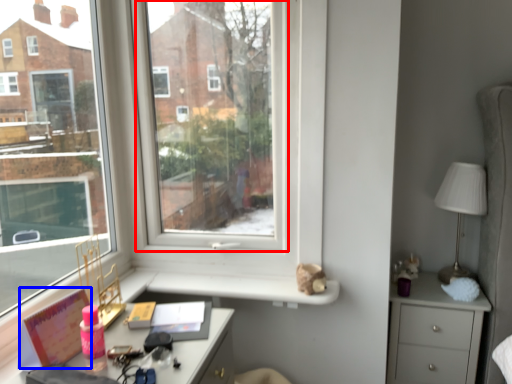
Question: Which object is closer to the camera taking this photo, window screen (highlighted by a red box) or book (highlighted by a blue box)?

Choices:
 (A) window screen
 (B) book

Answer: (B)